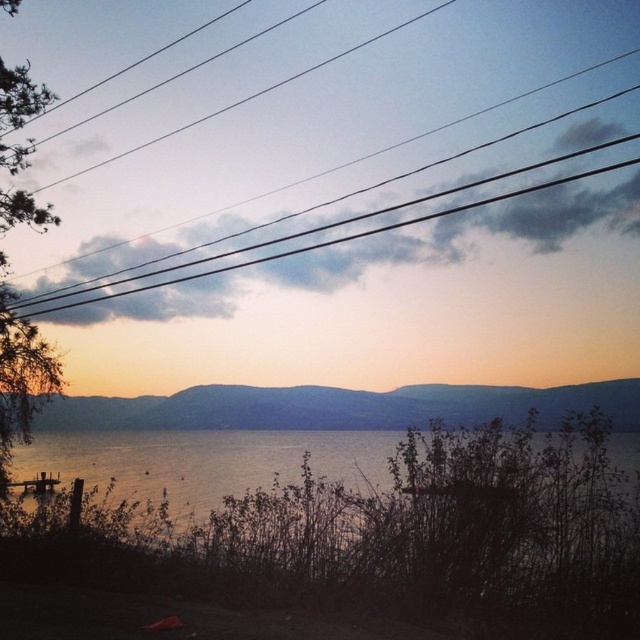
You are standing at the lakeside and want to walk from point A to point B. Point A is located at coordinates point (180,465) and point B is at point (216,19). Given that the terrain between them has some elevation changes, which point would you reach first if you start walking towards the horizon?

Point (180,465) is closer to the viewer than point (216,19), so you would reach point A first before point B when walking towards the horizon.

You are standing at the point marked by the coordinates point (x=204, y=460) in the image. Based on the scene described, what would you most likely see around you?

You would see silvery reflective water at lower center around you as the coordinates point (x=204, y=460) marks that location.

You are standing at the lakeside and want to take a photo of the black wire at upper center and the silvery reflective water at lower center. Can you fit both objects in the frame of your camera without moving your position?

The silvery reflective water at lower center is 8.29 meters away from the black wire at upper center. Since they are at different distances, you can still fit both in the frame as long as your camera has a wide enough angle to capture both objects at those distances.